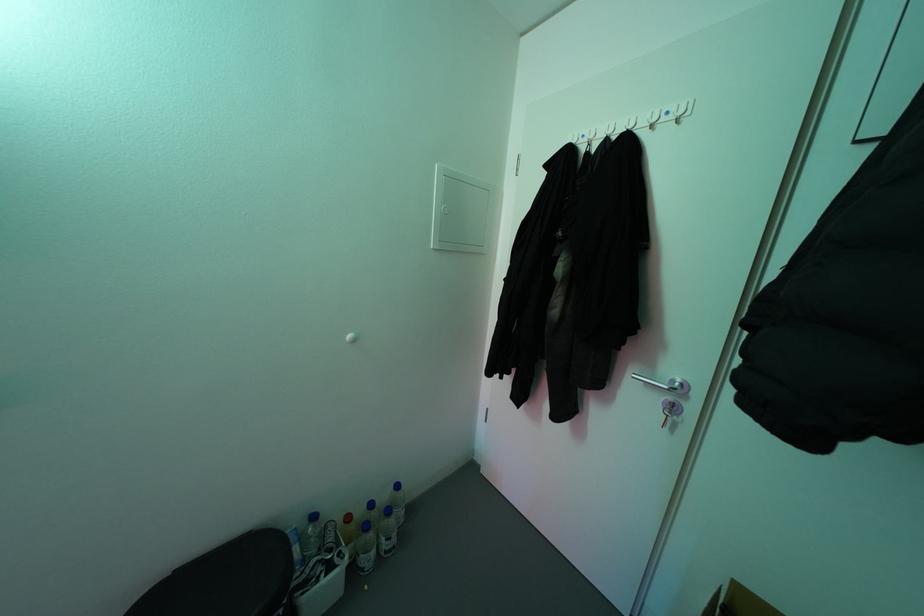
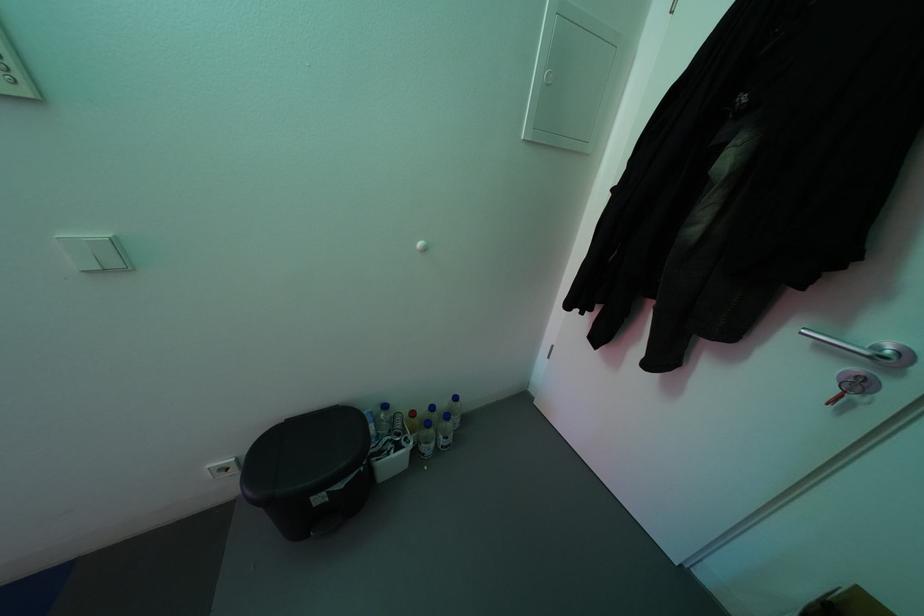
In a continuous first-person perspective shot, in which direction is the camera moving?

The cameraman walked toward left, forward.